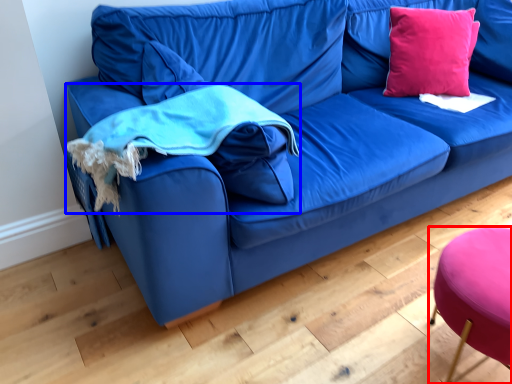
Question: Which of the following is the farthest to the observer, stool (highlighted by a red box) or cloth (highlighted by a blue box)?

Choices:
 (A) stool
 (B) cloth

Answer: (B)